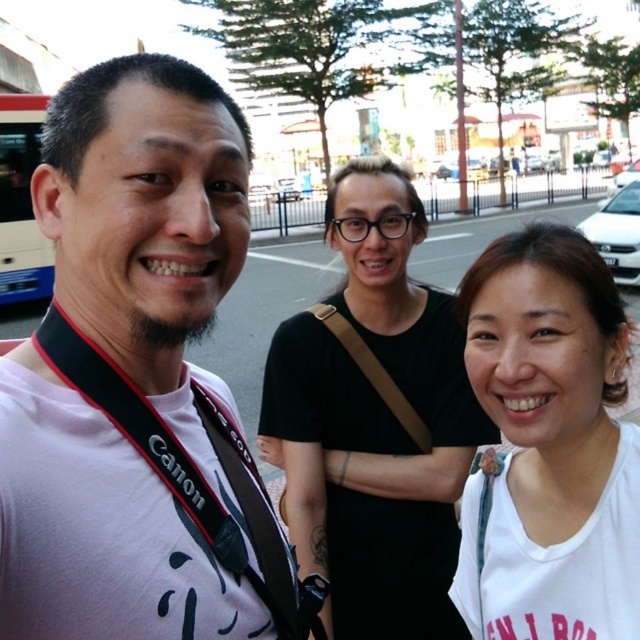
Based on the coordinates provided, what object is located at the point (x=374, y=420) in the image?

The point (x=374, y=420) indicates the white matte shirt at center.

Based on the photo, you are a photographer trying to arrange two subjects for a photo shoot. You have a pink fabric shirt at left and a white matte shirt at center. According to the scene, which shirt is positioned more to the left?

The pink fabric shirt at left is positioned more to the left than the white matte shirt at center.

You are a photographer trying to capture a group photo. You notice the pink fabric shirt at left and the white matte tank top at center. Which clothing item is closer to the camera?

The pink fabric shirt at left is in front of the white matte tank top at center, so it is closer to the camera.